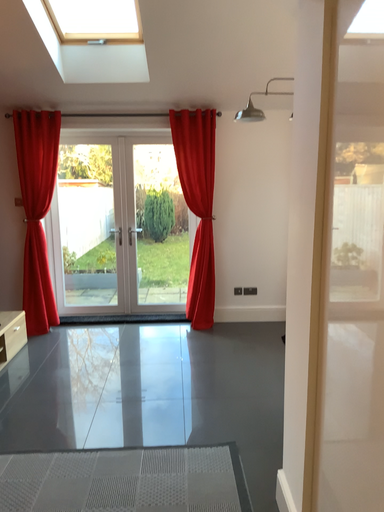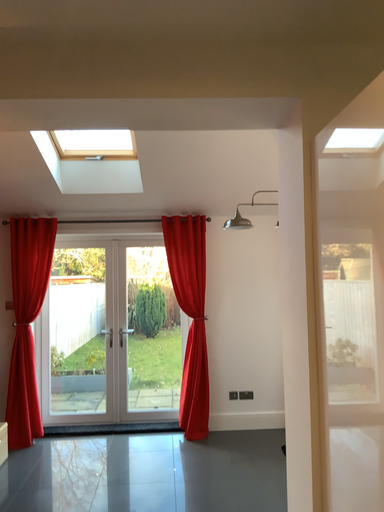
Question: Which way did the camera rotate in the video?

Choices:
 (A) rotated upward
 (B) rotated downward

Answer: (A)